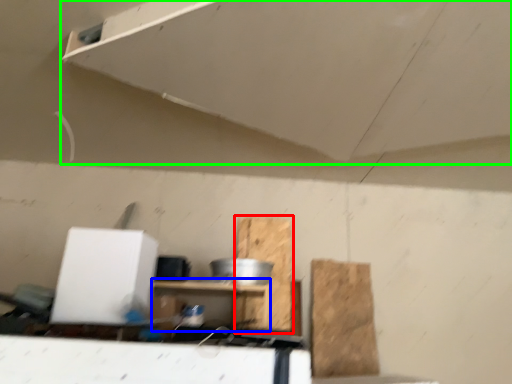
Question: Estimate the real-world distances between objects in this image. Which object is closer to cardboard (highlighted by a red box), furniture (highlighted by a blue box) or exhaust hood (highlighted by a green box)?

Choices:
 (A) furniture
 (B) exhaust hood

Answer: (A)